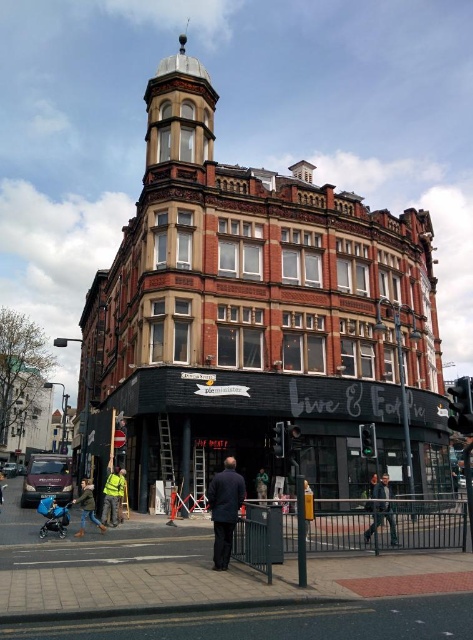
Does point (117, 499) lie behind point (93, 484)?

No, (117, 499) is closer to viewer.

Is point (106, 497) closer to viewer compared to point (81, 490)?

Yes, it is in front of point (81, 490).

Which is in front, point (112, 524) or point (89, 508)?

Point (89, 508)

This screenshot has height=640, width=473. I want to click on yellow reflective vest at lower left, so click(x=113, y=497).

Can you confirm if dark blue jeans at lower center is positioned to the left of light blue denim jacket at lower left?

In fact, dark blue jeans at lower center is to the right of light blue denim jacket at lower left.

This screenshot has width=473, height=640. I want to click on dark blue jeans at lower center, so click(382, 509).

Can you confirm if dark blue suit at center is shorter than light blue denim jacket at lower left?

Yes.

Locate an element on the screen. The width and height of the screenshot is (473, 640). dark blue suit at center is located at coordinates (225, 509).